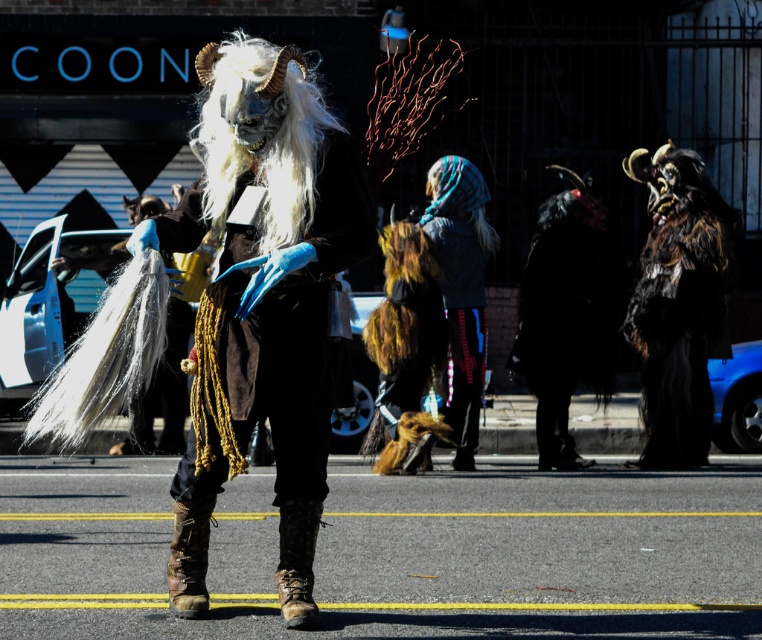
Question: Which point is closer to the camera?

Choices:
 (A) (661, 324)
 (B) (207, 108)
 (C) (466, 252)

Answer: (B)

Question: Is plaid wool scarf at center above leather/canvas cowboy boot at lower center?

Choices:
 (A) no
 (B) yes

Answer: (B)

Question: Can you confirm if shiny silver mask at center is wider than brown leather cowboy boot at lower center?

Choices:
 (A) no
 (B) yes

Answer: (B)

Question: Considering the relative positions of white woolen wig at center and brown leather cowboy boot at lower center in the image provided, where is white woolen wig at center located with respect to brown leather cowboy boot at lower center?

Choices:
 (A) below
 (B) above

Answer: (B)

Question: Which point is farther from the camera taking this photo?

Choices:
 (A) [x=469, y=330]
 (B) [x=668, y=438]
 (C) [x=306, y=566]
 (D) [x=327, y=214]

Answer: (B)

Question: Estimate the real-world distances between objects in this image. Which object is closer to the brown leather cowboy boot at lower center?

Choices:
 (A) white woolen wig at center
 (B) shiny silver mask at center
 (C) plaid wool scarf at center
 (D) fuzzy black fur at right

Answer: (B)